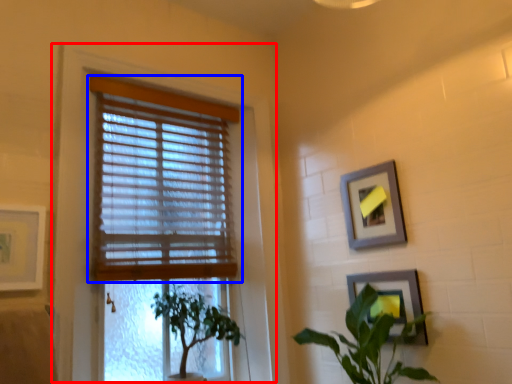
Question: Among these objects, which one is farthest to the camera, window frame (highlighted by a red box) or window blind (highlighted by a blue box)?

Choices:
 (A) window frame
 (B) window blind

Answer: (B)